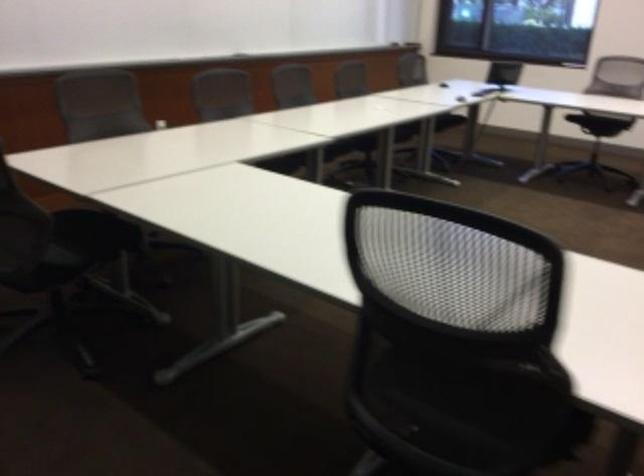
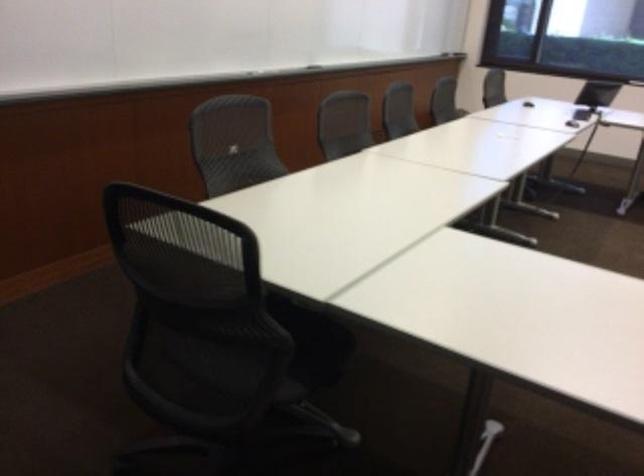
Which direction would the cameraman need to move to produce the second image?

The movement direction of the cameraman is left, forward.